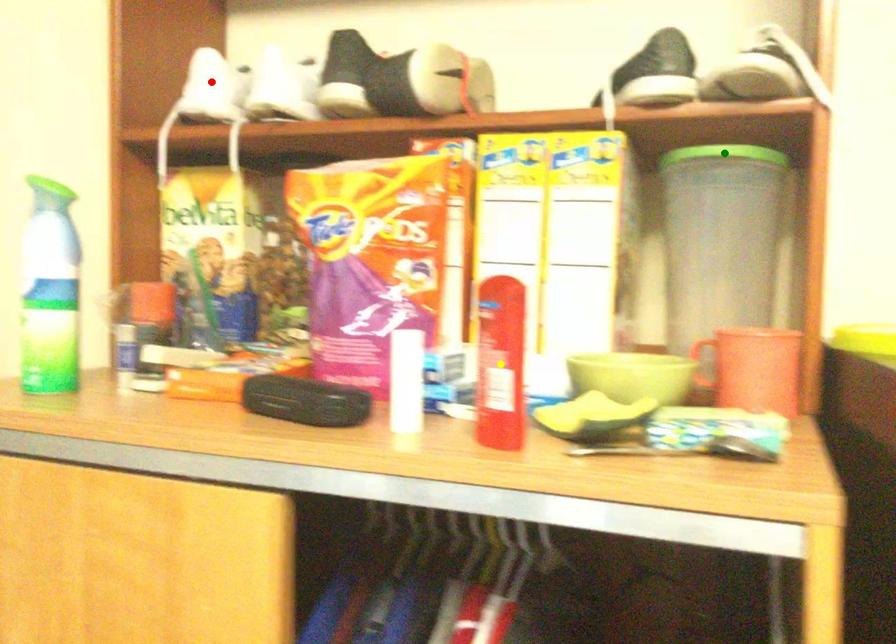
Order these from nearest to farthest:
green point, red point, yellow point

yellow point < green point < red point